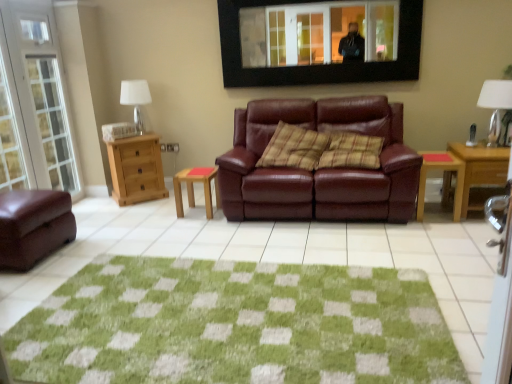
Question: Considering the relative positions of green textured rug at center and black framed mirror at upper center in the image provided, is green textured rug at center to the right of black framed mirror at upper center from the viewer's perspective?

Choices:
 (A) yes
 (B) no

Answer: (B)

Question: From the image's perspective, is green textured rug at center on black framed mirror at upper center?

Choices:
 (A) yes
 (B) no

Answer: (B)

Question: Is green textured rug at center surrounding black framed mirror at upper center?

Choices:
 (A) yes
 (B) no

Answer: (B)

Question: Is green textured rug at center oriented towards black framed mirror at upper center?

Choices:
 (A) no
 (B) yes

Answer: (A)

Question: Is green textured rug at center thinner than black framed mirror at upper center?

Choices:
 (A) no
 (B) yes

Answer: (A)

Question: Considering the relative positions of matte brown leather ottoman at lower left, arranged as the second studio couch when viewed from the right, and white fabric lampshade at left, arranged as the 1th lamp when viewed from the back, in the image provided, is matte brown leather ottoman at lower left, arranged as the second studio couch when viewed from the right, to the left or to the right of white fabric lampshade at left, arranged as the 1th lamp when viewed from the back,?

Choices:
 (A) left
 (B) right

Answer: (A)

Question: Is matte brown leather ottoman at lower left, arranged as the second studio couch when viewed from the right, wider or thinner than white fabric lampshade at left, arranged as the 2th lamp when viewed from the front?

Choices:
 (A) thin
 (B) wide

Answer: (B)

Question: Is matte brown leather ottoman at lower left, which appears as the first studio couch when viewed from the left, taller or shorter than white fabric lampshade at left, arranged as the 2th lamp when viewed from the front?

Choices:
 (A) tall
 (B) short

Answer: (B)

Question: In terms of size, does matte brown leather ottoman at lower left, arranged as the second studio couch when viewed from the right, appear bigger or smaller than white fabric lampshade at left, arranged as the 2th lamp when viewed from the front?

Choices:
 (A) small
 (B) big

Answer: (B)

Question: Is green textured rug at center spatially inside wooden desk at right, or outside of it?

Choices:
 (A) inside
 (B) outside

Answer: (B)

Question: Considering the relative positions of green textured rug at center and wooden desk at right in the image provided, is green textured rug at center to the left or to the right of wooden desk at right?

Choices:
 (A) left
 (B) right

Answer: (A)

Question: Is green textured rug at center taller or shorter than wooden desk at right?

Choices:
 (A) tall
 (B) short

Answer: (B)

Question: Considering the positions of green textured rug at center and wooden desk at right in the image, is green textured rug at center wider or thinner than wooden desk at right?

Choices:
 (A) thin
 (B) wide

Answer: (B)

Question: From a real-world perspective, is wooden dresser at left physically located above or below white fabric lampshade at left, arranged as the 2th lamp when viewed from the front?

Choices:
 (A) above
 (B) below

Answer: (B)

Question: Is wooden dresser at left situated inside white fabric lampshade at left, the second lamp viewed from the right, or outside?

Choices:
 (A) outside
 (B) inside

Answer: (A)